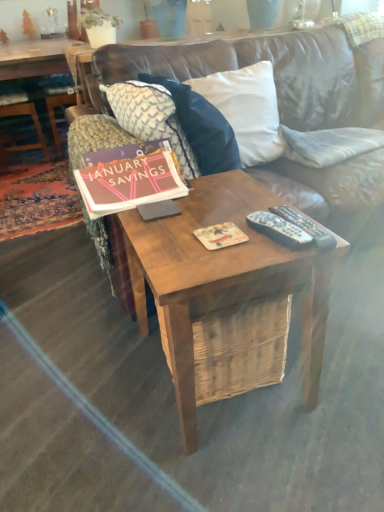
Question: Considering the relative positions of white matte pot at upper left and matte pink paper at center in the image provided, is white matte pot at upper left behind matte pink paper at center?

Choices:
 (A) yes
 (B) no

Answer: (A)

Question: Considering the relative sizes of white matte pot at upper left and matte pink paper at center in the image provided, is white matte pot at upper left bigger than matte pink paper at center?

Choices:
 (A) yes
 (B) no

Answer: (A)

Question: Are white matte pot at upper left and matte pink paper at center far apart?

Choices:
 (A) no
 (B) yes

Answer: (B)

Question: Can you confirm if white matte pot at upper left is wider than matte pink paper at center?

Choices:
 (A) no
 (B) yes

Answer: (B)

Question: Is matte pink paper at center a part of white matte pot at upper left?

Choices:
 (A) yes
 (B) no

Answer: (B)

Question: From the image's perspective, is black plastic remote controls at center, arranged as the 1th remote control when viewed from the right, positioned above or below matte pink paper at center?

Choices:
 (A) below
 (B) above

Answer: (A)

Question: Which is correct: black plastic remote controls at center, arranged as the 1th remote control when viewed from the right, is inside matte pink paper at center, or outside of it?

Choices:
 (A) outside
 (B) inside

Answer: (A)

Question: Visually, is black plastic remote controls at center, arranged as the 1th remote control when viewed from the right, positioned to the left or to the right of matte pink paper at center?

Choices:
 (A) right
 (B) left

Answer: (A)

Question: From their relative heights in the image, would you say black plastic remote controls at center, arranged as the 1th remote control when viewed from the right, is taller or shorter than matte pink paper at center?

Choices:
 (A) short
 (B) tall

Answer: (A)

Question: From a real-world perspective, is matte pink paper at center physically located above or below woodenwoodencoffee table at left?

Choices:
 (A) below
 (B) above

Answer: (B)

Question: From the image's perspective, is matte pink paper at center above or below woodenwoodencoffee table at left?

Choices:
 (A) below
 (B) above

Answer: (A)

Question: From their relative heights in the image, would you say matte pink paper at center is taller or shorter than woodenwoodencoffee table at left?

Choices:
 (A) tall
 (B) short

Answer: (B)

Question: In the image, is matte pink paper at center positioned in front of or behind woodenwoodencoffee table at left?

Choices:
 (A) behind
 (B) front

Answer: (B)

Question: Is white fabric pillow at upper right, the third pillow in the left-to-right sequence, inside or outside of black plastic remote controls at center, the 2th remote control from the left?

Choices:
 (A) inside
 (B) outside

Answer: (B)

Question: Is point (319, 152) positioned closer to the camera than point (274, 210)?

Choices:
 (A) closer
 (B) farther

Answer: (B)